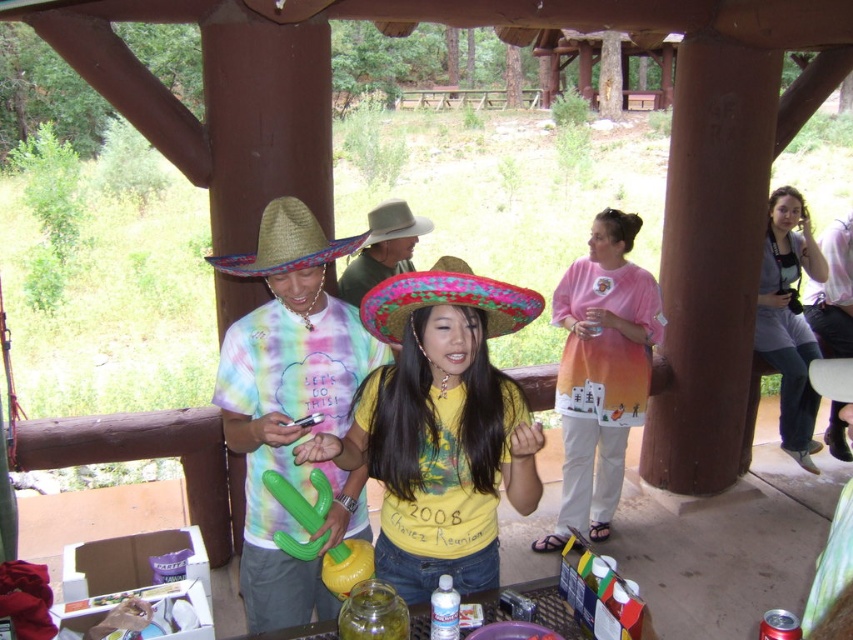
Question: Considering the relative positions of matte pink shirt at center and white felt cowboy hat at center in the image provided, where is matte pink shirt at center located with respect to white felt cowboy hat at center?

Choices:
 (A) below
 (B) above

Answer: (A)

Question: Which point is farther to the camera?

Choices:
 (A) multicolored felt sombrero at center
 (B) yellow t-shirt at center
 (C) strawhat at center
 (D) rustic straw hat at center

Answer: (D)

Question: Is matte pink shirt at center wider than rustic straw hat at center?

Choices:
 (A) yes
 (B) no

Answer: (A)

Question: Which point is closer to the camera?

Choices:
 (A) white felt cowboy hat at center
 (B) yellow matte shirt at center

Answer: (B)

Question: Which point is closer to the camera taking this photo?

Choices:
 (A) (791, 376)
 (B) (479, 582)
 (C) (439, 292)

Answer: (C)

Question: Does matte pink shirt at center appear over rustic straw hat at center?

Choices:
 (A) yes
 (B) no

Answer: (B)